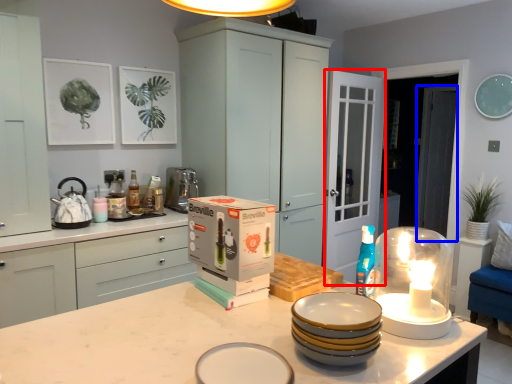
Question: Which object appears farthest to the camera in this image, glass door (highlighted by a red box) or glass door (highlighted by a blue box)?

Choices:
 (A) glass door
 (B) glass door

Answer: (B)